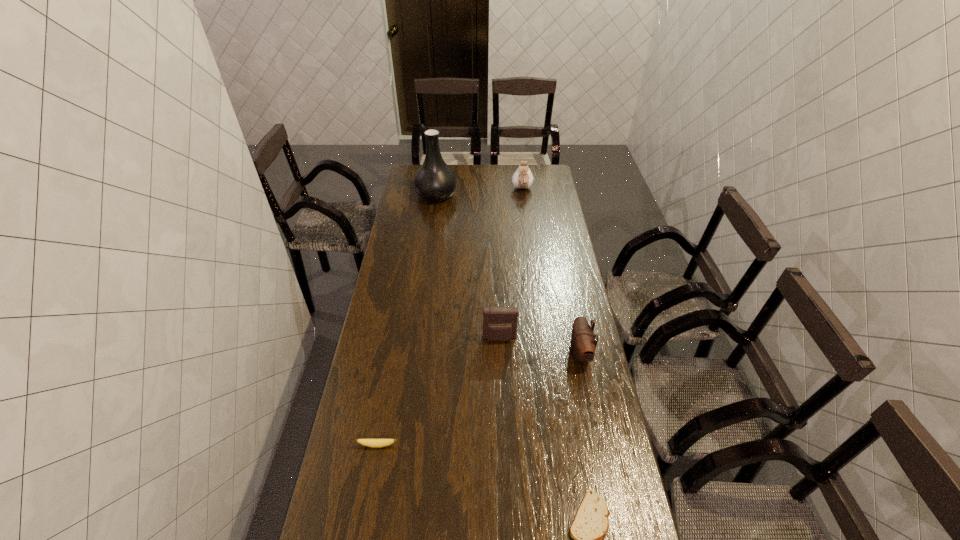
The height and width of the screenshot is (540, 960). I want to click on blank region between the fourth object from right to left and the banana, so click(439, 392).

Find the location of `free space between the vase and the third object from left to right`. free space between the vase and the third object from left to right is located at coordinates (468, 267).

The image size is (960, 540). In order to click on unoccupied position between the rightmost pouch and the fifth tallest object in this screenshot , I will do `click(478, 400)`.

Where is `the second closest object to the leftmost pouch`? The height and width of the screenshot is (540, 960). the second closest object to the leftmost pouch is located at coordinates (374, 443).

Select which object is the second closest to the nearest object. Please provide its 2D coordinates. Your answer should be formatted as a tuple, i.e. [(x, y)], where the tuple contains the x and y coordinates of a point satisfying the conditions above.

[(374, 443)]

Locate an element on the screen. The width and height of the screenshot is (960, 540). pouch that is the closest to the vase is located at coordinates (522, 178).

Where is `pouch identified as the closest to the leftmost pouch`? This screenshot has height=540, width=960. pouch identified as the closest to the leftmost pouch is located at coordinates (583, 343).

Find the location of `vacant space that satisfies the following two spatial constraints: 1. with the flap open on the rightmost pouch; 2. on the front side of the second shortest object`. vacant space that satisfies the following two spatial constraints: 1. with the flap open on the rightmost pouch; 2. on the front side of the second shortest object is located at coordinates (598, 445).